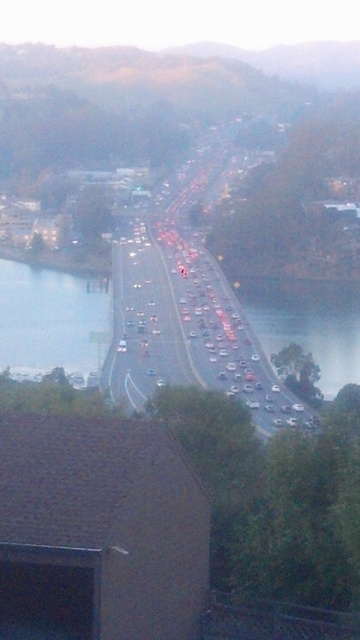
You are standing at the point with coordinates point (x=0, y=259) and want to walk towards the point with coordinates point (x=217, y=356). Which direction should you move in?

You should move towards the point (x=217, y=356) because it is closer to the viewer than point (x=0, y=259).

You are a driver approaching the metallic silver highway at center and the clear water at lower left. Which one is closer to your current position?

The clear water at lower left is closer to your current position because the metallic silver highway at center is to the right of clear water at lower left, meaning the highway is further away from you.